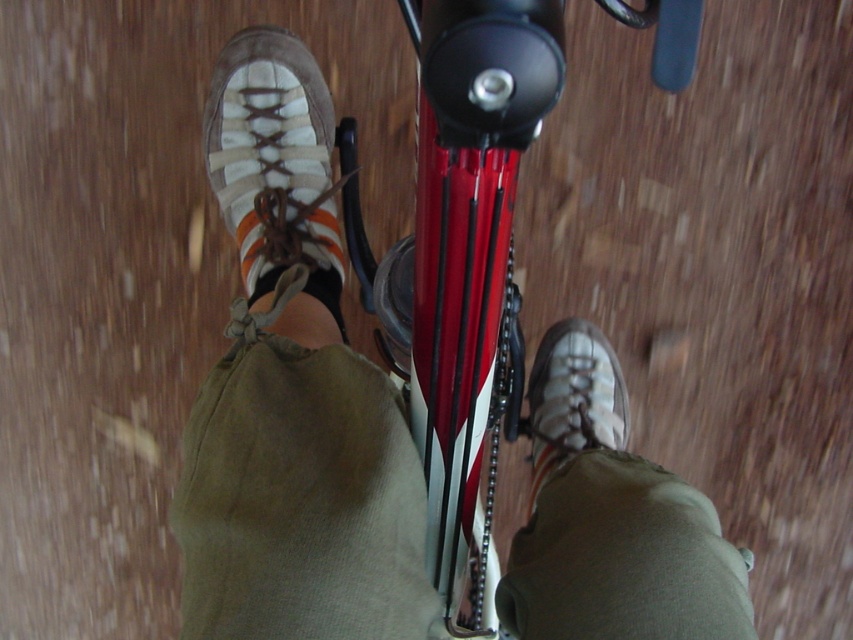
You are trying to decide which shoe to wear for a casual walk. Both the leather shoe at center and the brown suede shoe at lower right are options. Which one has a wider base for better stability?

The leather shoe at center has a wider base than the brown suede shoe at lower right, providing better stability.

Consider the image. You are riding a bicycle indoors and notice two points marked on the floor. The first point is at coordinates point (546, 465) and the second is at point (251, 216). Which point is closer to your current position as you ride forward?

Point (546, 465) is in front of point (251, 216), so the point closer to your current position as you ride forward would be point (251, 216) since it is behind you.